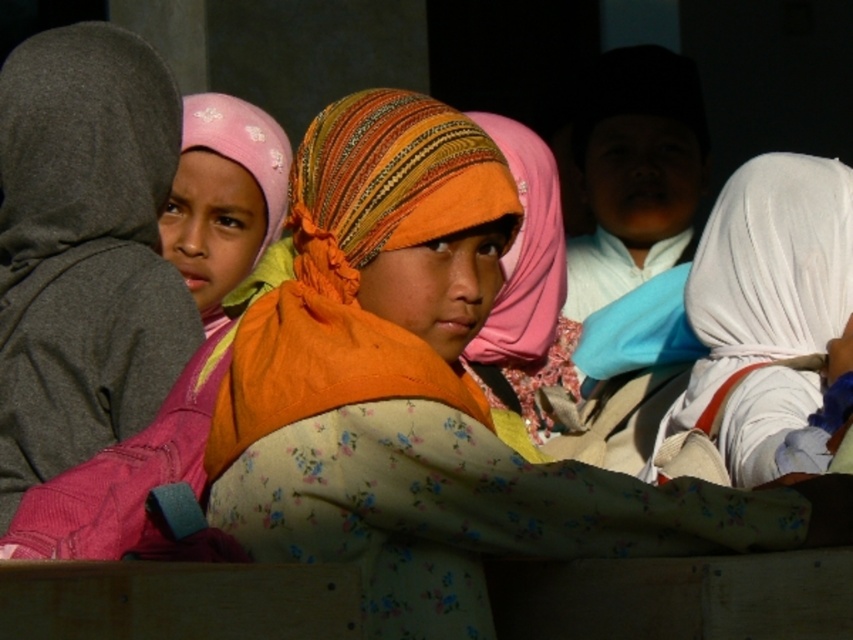
Question: Which point is farther to the camera?

Choices:
 (A) pink fabric headscarf at left
 (B) orange fabric headscarf at center
 (C) floral fabric headscarf at center
 (D) orange woven headscarf at center

Answer: (D)

Question: Among these points, which one is farthest from the camera?

Choices:
 (A) (323, 289)
 (B) (351, 324)

Answer: (A)

Question: Which object appears closest to the camera in this image?

Choices:
 (A) pink fabric headscarf at left
 (B) orange woven headscarf at center
 (C) orange fabric headscarf at center

Answer: (C)

Question: Can you confirm if pink fabric headscarf at left is positioned to the left of orange woven headscarf at center?

Choices:
 (A) no
 (B) yes

Answer: (B)

Question: Does floral fabric headscarf at center have a lesser width compared to pink fabric headscarf at left?

Choices:
 (A) no
 (B) yes

Answer: (A)

Question: Is the position of floral fabric headscarf at center more distant than that of orange woven headscarf at center?

Choices:
 (A) no
 (B) yes

Answer: (A)